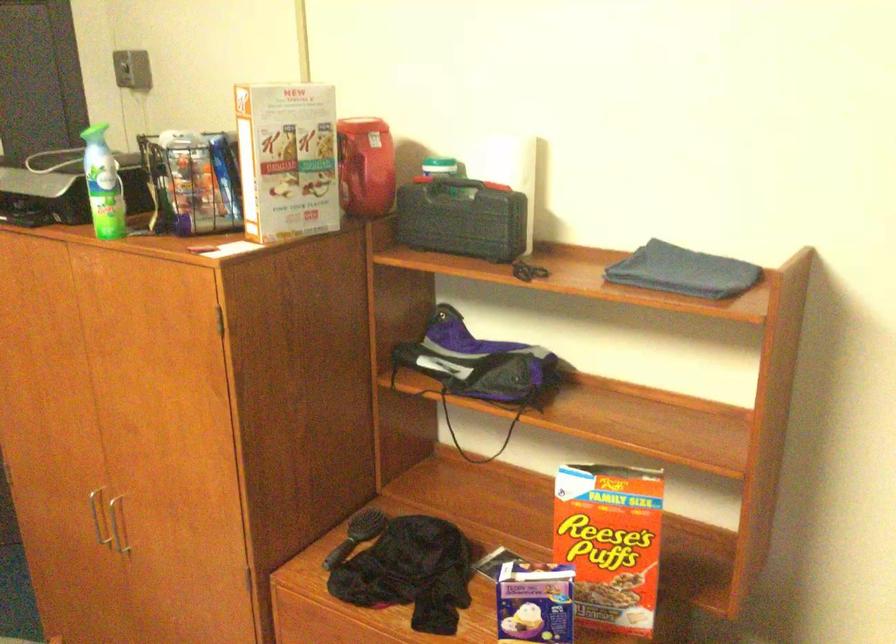
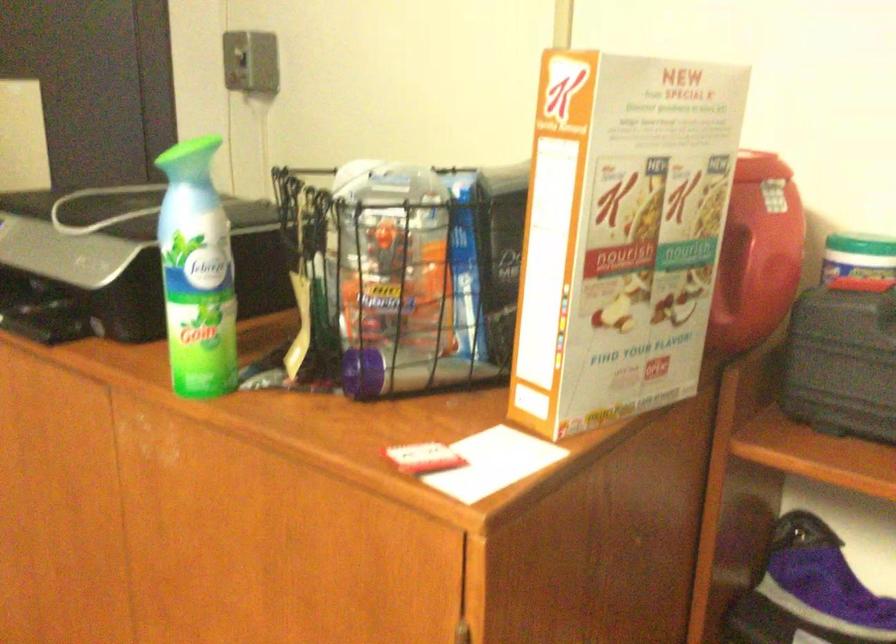
Find the pixel in the second image that matches pixel 95 127 in the first image.

(194, 147)